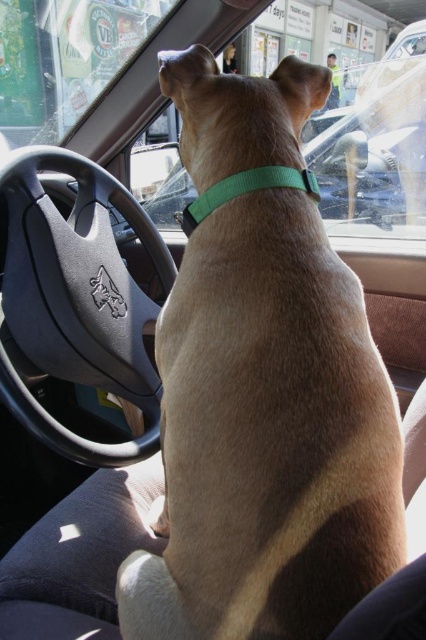
You are a passenger in the car and want to know where the dog is sitting. Based on the coordinates provided, can you tell me the exact location of the brown matte dog at center within the car?

The brown matte dog at center is located at coordinates point (267, 436) within the car.